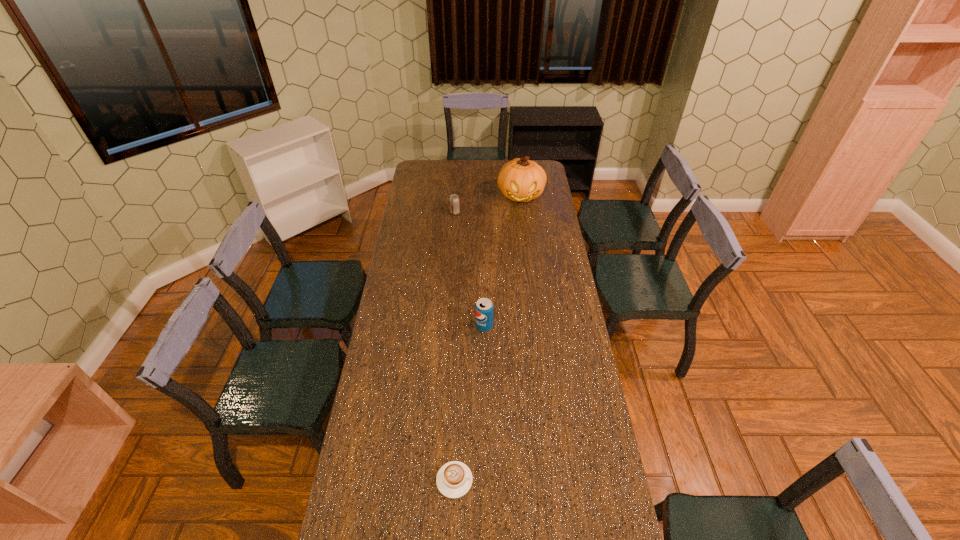
At what (x,y) coordinates should I click in order to perform the action: click on free space that satisfies the following two spatial constraints: 1. on the front face of the tallest object; 2. with the handle on the right side of the shortest object. Please return your answer as a coordinate pair (x, y). The image size is (960, 540). Looking at the image, I should click on (555, 480).

Locate an element on the screen. The height and width of the screenshot is (540, 960). blank area in the image that satisfies the following two spatial constraints: 1. on the front face of the pumpkin; 2. with the handle on the right side of the nearest object is located at coordinates (555, 480).

Locate an element on the screen. Image resolution: width=960 pixels, height=540 pixels. vacant space that satisfies the following two spatial constraints: 1. on the front face of the tallest object; 2. with the handle on the right side of the cappuccino is located at coordinates (555, 480).